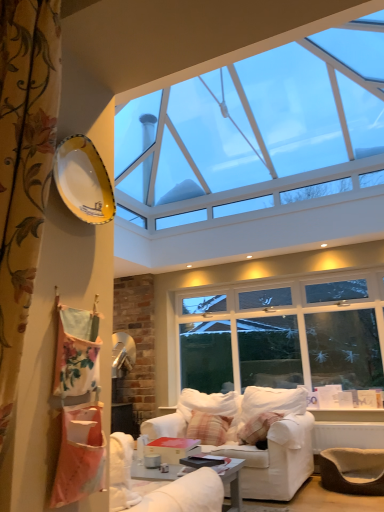
This screenshot has width=384, height=512. Describe the element at coordinates (83, 180) in the screenshot. I see `yellow glossy plate at upper left` at that location.

This screenshot has height=512, width=384. What do you see at coordinates (208, 428) in the screenshot? I see `plaid fabric pillow at center` at bounding box center [208, 428].

Find the location of `transparent glass window at upper center`. transparent glass window at upper center is located at coordinates (249, 121).

In order to click on yellow glossy plate at upper left in this screenshot , I will do `click(83, 180)`.

From a real-world perspective, which object stands above the other?

yellow glossy plate at upper left.

Considering their positions, is yellow glossy plate at upper left located in front of or behind brown woven armchair at lower right?

Clearly, yellow glossy plate at upper left is in front of brown woven armchair at lower right.

Does point (94, 149) come farther from viewer compared to point (383, 454)?

No, it is in front of (383, 454).

Which of these two, yellow glossy plate at upper left or brown woven armchair at lower right, is bigger?

brown woven armchair at lower right.

Locate an element on the screen. This screenshot has height=512, width=384. armchair that is under the yellow glossy plate at upper left (from a real-world perspective) is located at coordinates (353, 470).

Is brown woven armchair at lower right aimed at yellow glossy plate at upper left?

No, brown woven armchair at lower right is not turned towards yellow glossy plate at upper left.

Does brown woven armchair at lower right appear on the right side of yellow glossy plate at upper left?

Yes.

Considering the sizes of objects brown woven armchair at lower right and yellow glossy plate at upper left in the image provided, who is wider, brown woven armchair at lower right or yellow glossy plate at upper left?

With larger width is brown woven armchair at lower right.

Does plaid fabric pillow at center touch floral fabric curtain at left?

No, plaid fabric pillow at center is not making contact with floral fabric curtain at left.

Is plaid fabric pillow at center at the right side of floral fabric curtain at left?

Indeed, plaid fabric pillow at center is positioned on the right side of floral fabric curtain at left.

From the image's perspective, would you say plaid fabric pillow at center is shown under floral fabric curtain at left?

Yes, from the image's perspective, plaid fabric pillow at center is below floral fabric curtain at left.

Is plaid fabric pillow at center located outside floral fabric curtain at left?

Yes, plaid fabric pillow at center is located beyond the bounds of floral fabric curtain at left.

Is point (226, 425) in front of point (378, 47)?

No, (226, 425) is further to viewer.

From a real-world perspective, is plaid fabric pillow at center physically above transparent glass window at upper center?

No.

Considering the sizes of objects plaid fabric pillow at center and transparent glass window at upper center in the image provided, who is bigger, plaid fabric pillow at center or transparent glass window at upper center?

transparent glass window at upper center.

From the image's perspective, is plaid fabric pillow at center located beneath transparent glass window at upper center?

Indeed, from the image's perspective, plaid fabric pillow at center is shown beneath transparent glass window at upper center.

Based on the photo, in terms of size, does plaid fabric pillow at center appear bigger or smaller than yellow glossy plate at upper left?

plaid fabric pillow at center is bigger than yellow glossy plate at upper left.

From the image's perspective, between plaid fabric pillow at center and yellow glossy plate at upper left, who is located below?

plaid fabric pillow at center appears lower in the image.

Which is in front, plaid fabric pillow at center or yellow glossy plate at upper left?

yellow glossy plate at upper left is more forward.

From the image's perspective, is brown woven armchair at lower right positioned above or below transparent glass window at upper center?

From the image's perspective, brown woven armchair at lower right appears below transparent glass window at upper center.

Is point (327, 471) positioned before point (161, 113)?

Yes, point (327, 471) is in front of point (161, 113).

In the scene shown: Between brown woven armchair at lower right and transparent glass window at upper center, which one has more height?

brown woven armchair at lower right.

Considering the relative positions of yellow glossy plate at upper left and transparent glass window at upper center in the image provided, is yellow glossy plate at upper left to the left or to the right of transparent glass window at upper center?

Clearly, yellow glossy plate at upper left is on the left of transparent glass window at upper center in the image.

Is yellow glossy plate at upper left oriented away from transparent glass window at upper center?

yellow glossy plate at upper left does not have its back to transparent glass window at upper center.

Which of these two, yellow glossy plate at upper left or transparent glass window at upper center, stands shorter?

transparent glass window at upper center is shorter.

Locate an element on the screen. This screenshot has width=384, height=512. armchair that is below the yellow glossy plate at upper left (from the image's perspective) is located at coordinates pyautogui.click(x=353, y=470).

Identify the location of armchair behind the yellow glossy plate at upper left. (353, 470).

From the image, which object appears to be farther from white fabric couch at center, brown woven armchair at lower right or yellow glossy plate at upper left?

yellow glossy plate at upper left.

Looking at the image, which one is located closer to brown woven armchair at lower right, floral fabric curtain at left or white fabric couch at center?

The object closer to brown woven armchair at lower right is white fabric couch at center.

When comparing their distances from white fabric couch at center, does floral fabric curtain at left or brown woven armchair at lower right seem further?

Among the two, floral fabric curtain at left is located further to white fabric couch at center.

Estimate the real-world distances between objects in this image. Which object is closer to transparent glass window at upper center, plaid fabric pillow at center or brown woven armchair at lower right?

The object closer to transparent glass window at upper center is plaid fabric pillow at center.

Which object lies further to the anchor point plaid fabric pillow at center, white fabric couch at center or yellow glossy plate at upper left?

Among the two, yellow glossy plate at upper left is located further to plaid fabric pillow at center.

From the image, which object appears to be farther from white fabric couch at center, floral fabric curtain at left or plaid fabric pillow at center?

floral fabric curtain at left lies further to white fabric couch at center than the other object.

Considering their positions, is white fabric couch at center positioned closer to yellow glossy plate at upper left than plaid fabric pillow at center?

white fabric couch at center lies closer to yellow glossy plate at upper left than the other object.

Based on their spatial positions, is yellow glossy plate at upper left or transparent glass window at upper center further from floral fabric curtain at left?

Among the two, transparent glass window at upper center is located further to floral fabric curtain at left.

Locate an element on the screen. The height and width of the screenshot is (512, 384). studio couch between yellow glossy plate at upper left and plaid fabric pillow at center in the front-back direction is located at coordinates (276, 454).

Locate an element on the screen. The image size is (384, 512). plate positioned between floral fabric curtain at left and plaid fabric pillow at center from near to far is located at coordinates (83, 180).

Find the location of a particular element. studio couch positioned between yellow glossy plate at upper left and brown woven armchair at lower right from near to far is located at coordinates (276, 454).

Where is `plate located between floral fabric curtain at left and transparent glass window at upper center in the depth direction`? The height and width of the screenshot is (512, 384). plate located between floral fabric curtain at left and transparent glass window at upper center in the depth direction is located at coordinates (83, 180).